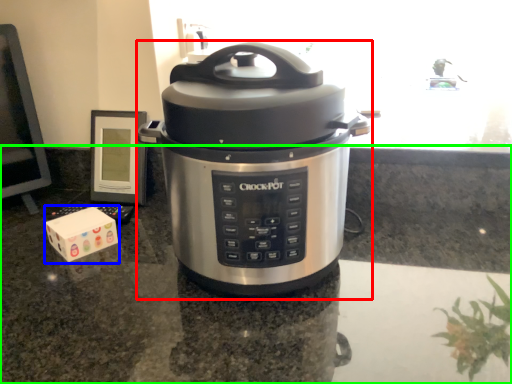
Question: Considering the real-world distances, which object is farthest from slow cooker (highlighted by a red box)? block (highlighted by a blue box) or counter top (highlighted by a green box)?

Choices:
 (A) block
 (B) counter top

Answer: (A)